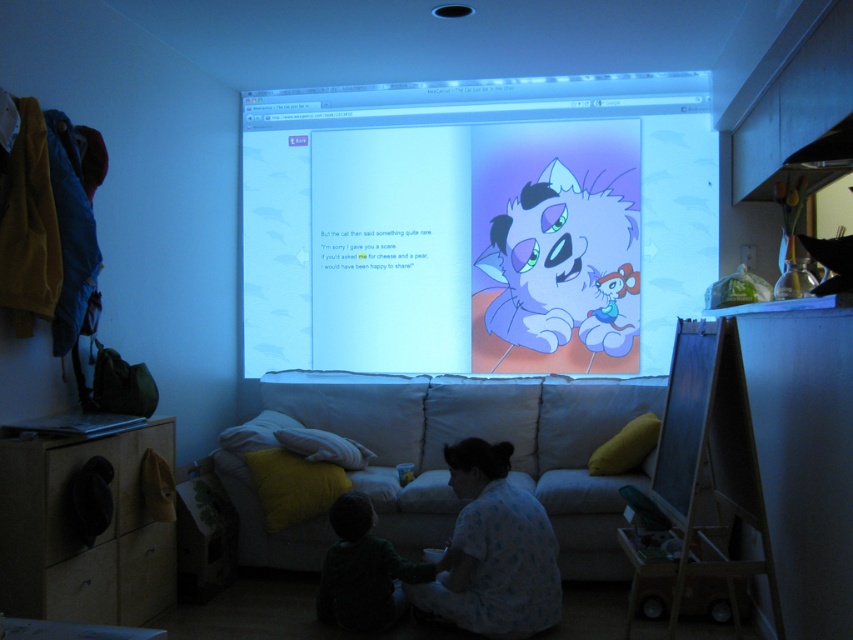
Question: Which point is closer to the camera?

Choices:
 (A) black matte whiteboard at lower right
 (B) white fabric couch at center

Answer: (A)

Question: Is dark green sweater at lower left positioned in front of black matte whiteboard at lower right?

Choices:
 (A) yes
 (B) no

Answer: (B)

Question: In this image, where is light blue cotton pajamas at lower center located relative to black matte whiteboard at lower right?

Choices:
 (A) above
 (B) below

Answer: (B)

Question: Estimate the real-world distances between objects in this image. Which object is farther from the white fabric couch at center?

Choices:
 (A) light blue cotton pajamas at lower center
 (B) dark green sweater at lower left

Answer: (A)

Question: Can you confirm if light blue cotton pajamas at lower center is bigger than black matte whiteboard at lower right?

Choices:
 (A) no
 (B) yes

Answer: (B)

Question: Among these objects, which one is nearest to the camera?

Choices:
 (A) light blue cotton pajamas at lower center
 (B) dark green sweater at lower left
 (C) black matte whiteboard at lower right
 (D) matte plastic screen at center

Answer: (C)